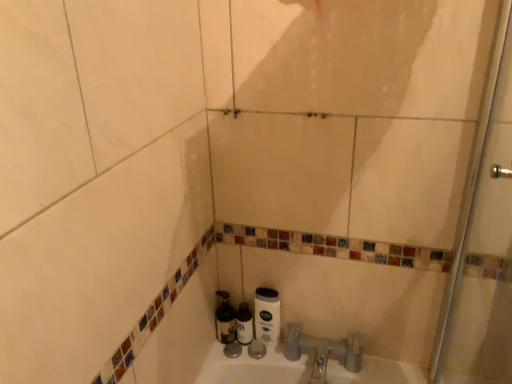
You are a GUI agent. You are given a task and a screenshot of the screen. Output one action in this format:
    pyautogui.click(x=<x>, y=<y>)
    Task: Click on the white matte toilet paper at lower center
    This screenshot has height=384, width=512.
    Given the screenshot: What is the action you would take?
    pyautogui.click(x=267, y=316)

The image size is (512, 384). Identify the location of transparent glass shower door at right. (483, 242).

Is metallic silver bottle at lower center, which ranks as the 1th bottle in left-to-right order, turned away from transparent glass shower door at right?

metallic silver bottle at lower center, which ranks as the 1th bottle in left-to-right order, is not turned away from transparent glass shower door at right.

From the image's perspective, is metallic silver bottle at lower center, which ranks as the 1th bottle in left-to-right order, located beneath transparent glass shower door at right?

Yes, from the image's perspective, metallic silver bottle at lower center, which ranks as the 1th bottle in left-to-right order, is below transparent glass shower door at right.

From a real-world perspective, is metallic silver bottle at lower center, which ranks as the 1th bottle in left-to-right order, positioned over transparent glass shower door at right based on gravity?

Actually, metallic silver bottle at lower center, which ranks as the 1th bottle in left-to-right order, is physically below transparent glass shower door at right in the real world.

Do you think metallic silver bottle at lower center, the 2th bottle positioned from the right, is within transparent glass shower door at right, or outside of it?

metallic silver bottle at lower center, the 2th bottle positioned from the right, is located beyond the bounds of transparent glass shower door at right.

Is white matte toilet paper at lower center smaller than translucent plastic bottle at center, the 2th bottle positioned from the left?

No, white matte toilet paper at lower center is not smaller than translucent plastic bottle at center, the 2th bottle positioned from the left.

From the image's perspective, is white matte toilet paper at lower center located above translucent plastic bottle at center, the 2th bottle positioned from the left?

Yes, from the image's perspective, white matte toilet paper at lower center is above translucent plastic bottle at center, the 2th bottle positioned from the left.

Is there a large distance between white matte toilet paper at lower center and translucent plastic bottle at center, the 2th bottle positioned from the left?

Actually, white matte toilet paper at lower center and translucent plastic bottle at center, the 2th bottle positioned from the left, are a little close together.

Is white matte toilet paper at lower center further to the viewer compared to translucent plastic bottle at center, the 2th bottle positioned from the left?

No, the depth of white matte toilet paper at lower center is less than that of translucent plastic bottle at center, the 2th bottle positioned from the left.

Which of these two, translucent plastic bottle at center, the 2th bottle positioned from the left, or metallic silver bottle at lower center, the 2th bottle positioned from the right, is wider?

Wider between the two is metallic silver bottle at lower center, the 2th bottle positioned from the right.

Is translucent plastic bottle at center, the first bottle positioned from the right, positioned with its back to metallic silver bottle at lower center, which ranks as the 1th bottle in left-to-right order?

translucent plastic bottle at center, the first bottle positioned from the right, is not turned away from metallic silver bottle at lower center, which ranks as the 1th bottle in left-to-right order.

Is translucent plastic bottle at center, the first bottle positioned from the right, far from metallic silver bottle at lower center, the 2th bottle positioned from the right?

No, translucent plastic bottle at center, the first bottle positioned from the right, is in close proximity to metallic silver bottle at lower center, the 2th bottle positioned from the right.

From the image's perspective, between translucent plastic bottle at center, the first bottle positioned from the right, and metallic silver bottle at lower center, the 2th bottle positioned from the right, who is located below?

translucent plastic bottle at center, the first bottle positioned from the right, appears lower in the image.

Considering the relative sizes of translucent plastic bottle at center, the 2th bottle positioned from the left, and transparent glass shower door at right in the image provided, is translucent plastic bottle at center, the 2th bottle positioned from the left, thinner than transparent glass shower door at right?

Indeed, translucent plastic bottle at center, the 2th bottle positioned from the left, has a lesser width compared to transparent glass shower door at right.

How far apart are translucent plastic bottle at center, the first bottle positioned from the right, and transparent glass shower door at right?

The distance of translucent plastic bottle at center, the first bottle positioned from the right, from transparent glass shower door at right is 27.09 inches.

Is translucent plastic bottle at center, the first bottle positioned from the right, to the left or to the right of transparent glass shower door at right in the image?

translucent plastic bottle at center, the first bottle positioned from the right, is positioned on transparent glass shower door at right's left side.

From a real-world perspective, is translucent plastic bottle at center, the 2th bottle positioned from the left, physically below transparent glass shower door at right?

Yes.

Based on their sizes in the image, would you say metallic silver bottle at lower center, the 2th bottle positioned from the right, is bigger or smaller than translucent plastic bottle at center, the first bottle positioned from the right?

metallic silver bottle at lower center, the 2th bottle positioned from the right, is bigger than translucent plastic bottle at center, the first bottle positioned from the right.

Between metallic silver bottle at lower center, which ranks as the 1th bottle in left-to-right order, and translucent plastic bottle at center, the first bottle positioned from the right, which one has smaller width?

translucent plastic bottle at center, the first bottle positioned from the right.

Are metallic silver bottle at lower center, the 2th bottle positioned from the right, and translucent plastic bottle at center, the first bottle positioned from the right, far apart?

Actually, metallic silver bottle at lower center, the 2th bottle positioned from the right, and translucent plastic bottle at center, the first bottle positioned from the right, are a little close together.

From the image's perspective, which one is positioned higher, metallic silver bottle at lower center, the 2th bottle positioned from the right, or translucent plastic bottle at center, the first bottle positioned from the right?

metallic silver bottle at lower center, the 2th bottle positioned from the right, from the image's perspective.

Is point (495, 240) in front of point (271, 288)?

Yes.

Can you tell me how much transparent glass shower door at right and white matte toilet paper at lower center differ in facing direction?

The angular difference between transparent glass shower door at right and white matte toilet paper at lower center is 89.5 degrees.

Which object is thinner, transparent glass shower door at right or white matte toilet paper at lower center?

Thinner between the two is white matte toilet paper at lower center.

From the picture: From the image's perspective, is transparent glass shower door at right on white matte toilet paper at lower center?

Yes, from the image's perspective, transparent glass shower door at right is on top of white matte toilet paper at lower center.

Is transparent glass shower door at right not near metallic silver bottle at lower center, which ranks as the 1th bottle in left-to-right order?

No, there isn't a large distance between transparent glass shower door at right and metallic silver bottle at lower center, which ranks as the 1th bottle in left-to-right order.

Considering the sizes of objects transparent glass shower door at right and metallic silver bottle at lower center, the 2th bottle positioned from the right, in the image provided, who is wider, transparent glass shower door at right or metallic silver bottle at lower center, the 2th bottle positioned from the right,?

metallic silver bottle at lower center, the 2th bottle positioned from the right, is wider.

Could you tell me if transparent glass shower door at right is turned towards metallic silver bottle at lower center, the 2th bottle positioned from the right?

No.

Considering the sizes of objects transparent glass shower door at right and metallic silver bottle at lower center, which ranks as the 1th bottle in left-to-right order, in the image provided, who is smaller, transparent glass shower door at right or metallic silver bottle at lower center, which ranks as the 1th bottle in left-to-right order,?

With smaller size is metallic silver bottle at lower center, which ranks as the 1th bottle in left-to-right order.

From a real-world perspective, which bottle is the 1st one underneath the transparent glass shower door at right? Please provide its 2D coordinates.

[(225, 319)]

Locate an element on the screen. The width and height of the screenshot is (512, 384). bottle that is the 1st object to the left of the white matte toilet paper at lower center, starting at the anchor is located at coordinates (244, 324).

From the picture: When comparing their distances from transparent glass shower door at right, does translucent plastic bottle at center, the 2th bottle positioned from the left, or metallic silver bottle at lower center, the 2th bottle positioned from the right, seem further?

metallic silver bottle at lower center, the 2th bottle positioned from the right, is positioned further to the anchor transparent glass shower door at right.

Estimate the real-world distances between objects in this image. Which object is closer to transparent glass shower door at right, white matte toilet paper at lower center or metallic silver bottle at lower center, which ranks as the 1th bottle in left-to-right order?

white matte toilet paper at lower center.

Looking at the image, which one is located closer to white matte toilet paper at lower center, metallic silver bottle at lower center, which ranks as the 1th bottle in left-to-right order, or translucent plastic bottle at center, the first bottle positioned from the right?

translucent plastic bottle at center, the first bottle positioned from the right, lies closer to white matte toilet paper at lower center than the other object.

Estimate the real-world distances between objects in this image. Which object is further from transparent glass shower door at right, white matte toilet paper at lower center or translucent plastic bottle at center, the first bottle positioned from the right?

Based on the image, translucent plastic bottle at center, the first bottle positioned from the right, appears to be further to transparent glass shower door at right.

When comparing their distances from white matte toilet paper at lower center, does translucent plastic bottle at center, the first bottle positioned from the right, or transparent glass shower door at right seem further?

Among the two, transparent glass shower door at right is located further to white matte toilet paper at lower center.

Looking at this image, looking at the image, which one is located closer to transparent glass shower door at right, metallic silver bottle at lower center, which ranks as the 1th bottle in left-to-right order, or translucent plastic bottle at center, the first bottle positioned from the right?

translucent plastic bottle at center, the first bottle positioned from the right, lies closer to transparent glass shower door at right than the other object.

Considering their positions, is transparent glass shower door at right positioned closer to white matte toilet paper at lower center than metallic silver bottle at lower center, the 2th bottle positioned from the right?

Among the two, metallic silver bottle at lower center, the 2th bottle positioned from the right, is located nearer to white matte toilet paper at lower center.

Looking at the image, which one is located further to metallic silver bottle at lower center, the 2th bottle positioned from the right, translucent plastic bottle at center, the 2th bottle positioned from the left, or white matte toilet paper at lower center?

white matte toilet paper at lower center.

Locate an element on the screen. bottle between transparent glass shower door at right and translucent plastic bottle at center, the first bottle positioned from the right, along the z-axis is located at coordinates (225, 319).

Locate an element on the screen. toilet paper located between transparent glass shower door at right and translucent plastic bottle at center, the 2th bottle positioned from the left, in the depth direction is located at coordinates (267, 316).

Locate an element on the screen. The width and height of the screenshot is (512, 384). toilet paper between transparent glass shower door at right and metallic silver bottle at lower center, which ranks as the 1th bottle in left-to-right order, from front to back is located at coordinates (x=267, y=316).

At what (x,y) coordinates should I click in order to perform the action: click on bottle situated between metallic silver bottle at lower center, which ranks as the 1th bottle in left-to-right order, and white matte toilet paper at lower center from left to right. Please return your answer as a coordinate pair (x, y). Image resolution: width=512 pixels, height=384 pixels. Looking at the image, I should click on (244, 324).